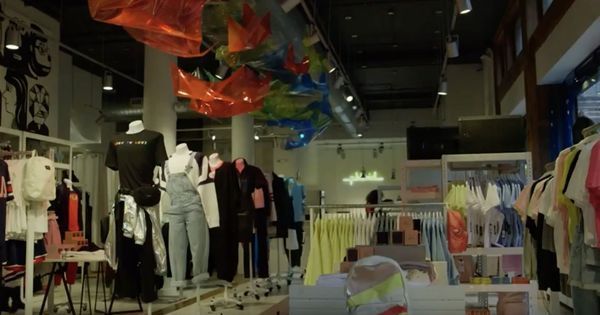
Image resolution: width=600 pixels, height=315 pixels. In order to click on shelf in this screenshot , I will do (505, 242), (511, 283), (420, 196), (60, 163), (5, 154).